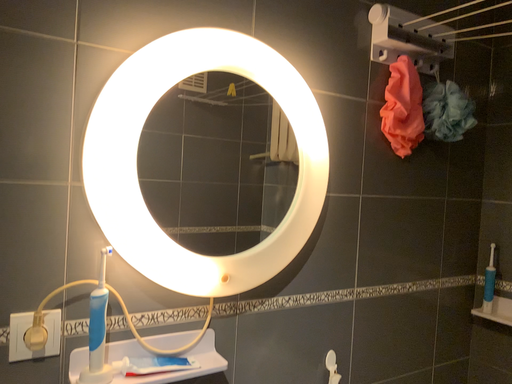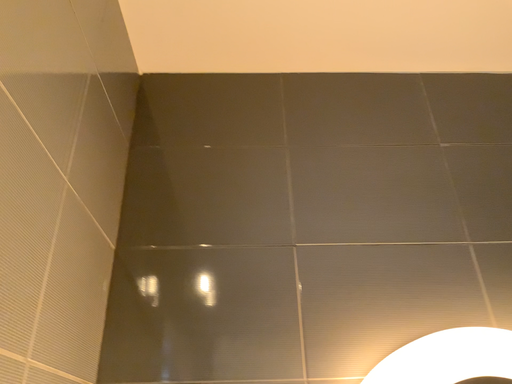
Question: Which way did the camera rotate in the video?

Choices:
 (A) rotated downward
 (B) rotated upward

Answer: (B)